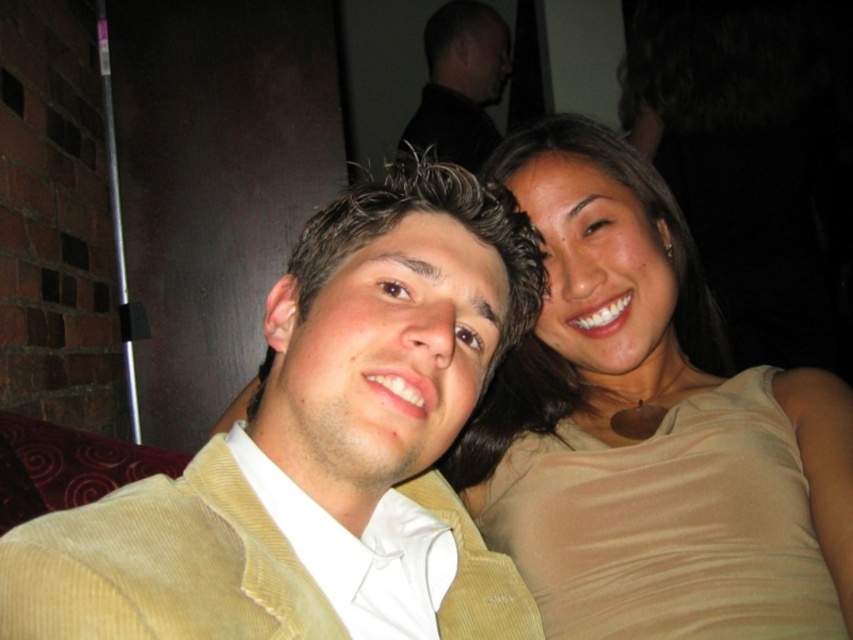
You are a photographer setting up for a closeup shot of the two people in the image. You need to ensure that both the matte beige tank top at right and the yellow corduroy jacket at center are clearly visible in the frame. Based on their positions, which clothing item should you focus on first to ensure it stays in the foreground?

The matte beige tank top at right is above the yellow corduroy jacket at center, so focusing on the yellow corduroy jacket at center first will keep it in the foreground since it is lower and closer to the camera.

You are a photographer trying to adjust the lighting for a photo shoot. You notice the matte beige tank top at right and the black corduroy jacket at upper center. Which clothing item might require more space in the frame to avoid being cut off?

The matte beige tank top at right might be wider than the black corduroy jacket at upper center, so it might require more space in the frame to avoid being cut off.

You are a photographer adjusting the lighting for a portrait. You need to ensure that the matte beige tank top at right is properly lit. Where should you place the light relative to the point marked at coordinate (x=651, y=429)?

The point at coordinate (x=651, y=429) marks the location of the matte beige tank top at right, so the light should be placed directly at that coordinate to ensure proper illumination.